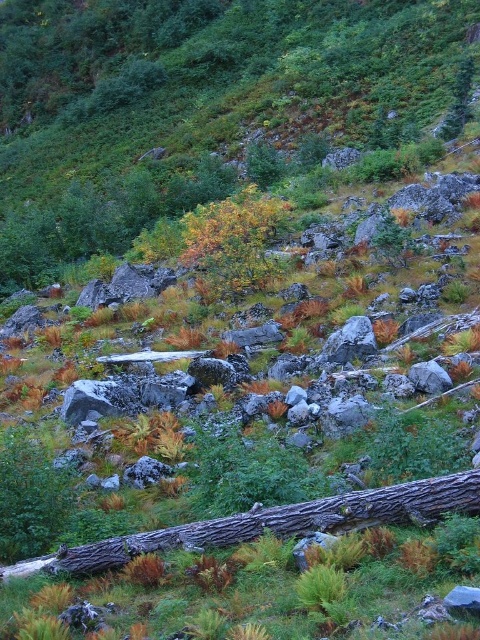
Question: Can you confirm if rough bark log at center is thinner than green matte tree at upper center?

Choices:
 (A) yes
 (B) no

Answer: (B)

Question: Does yellow-green foliage at center appear on the left side of green matte tree at upper center?

Choices:
 (A) yes
 (B) no

Answer: (A)

Question: Among these points, which one is farthest from the camera?

Choices:
 (A) (229, 244)
 (B) (457, 93)

Answer: (B)

Question: Does rough bark log at center appear under green matte tree at upper center?

Choices:
 (A) no
 (B) yes

Answer: (B)

Question: Which point appears closest to the camera in this image?

Choices:
 (A) (382, 496)
 (B) (468, 86)
 (C) (227, 248)

Answer: (A)

Question: Considering the real-world distances, which object is farthest from the green matte tree at upper center?

Choices:
 (A) yellow-green foliage at center
 (B) rough bark log at center

Answer: (B)